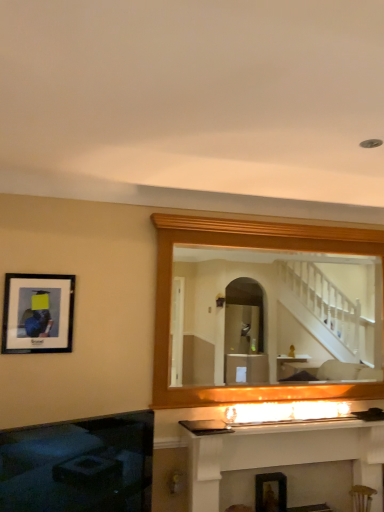
The width and height of the screenshot is (384, 512). In order to click on vacant space situated above wooden mirror at upper center (from a real-world perspective) in this screenshot , I will do `click(266, 218)`.